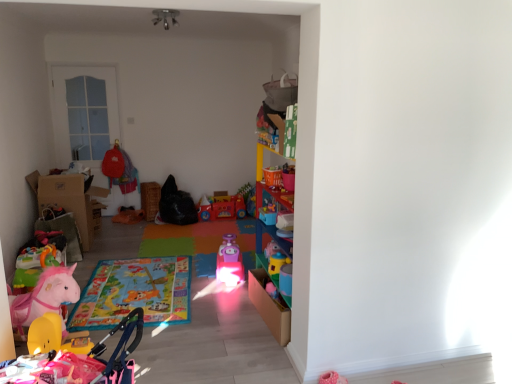
Question: Is pink plastic train at center bigger or smaller than orange plush toy at center, marked as the 2th toy in a back-to-front arrangement?

Choices:
 (A) big
 (B) small

Answer: (A)

Question: Visually, is pink plastic train at center positioned to the left or to the right of orange plush toy at center, which is counted as the fifth toy, starting from the front?

Choices:
 (A) right
 (B) left

Answer: (A)

Question: Which object is positioned closest to the pink plastic toy at center, which is counted as the third toy, starting from the back?

Choices:
 (A) orange plush toy at center, marked as the 2th toy in a back-to-front arrangement
 (B) rubberized plastic toy car at center, the 6th toy from the front
 (C) brown cardboard box at left
 (D) rubber yellow toy at lower left, which is the 1th toy from front to back
 (E) pink plush horse at lower left, the second toy when ordered from front to back

Answer: (B)

Question: Which is nearer to the rubberized plastic toy car at center, marked as the first toy in a back-to-front arrangement?

Choices:
 (A) matte plastic cup at center, which ranks as the fourth toy in back-to-front order
 (B) pink plush horse at lower left, which is the fifth toy in back-to-front order
 (C) orange plush toy at center, marked as the 2th toy in a back-to-front arrangement
 (D) pink plastic toy at center, the 4th toy viewed from the front
 (E) brown cardboard box at left

Answer: (D)